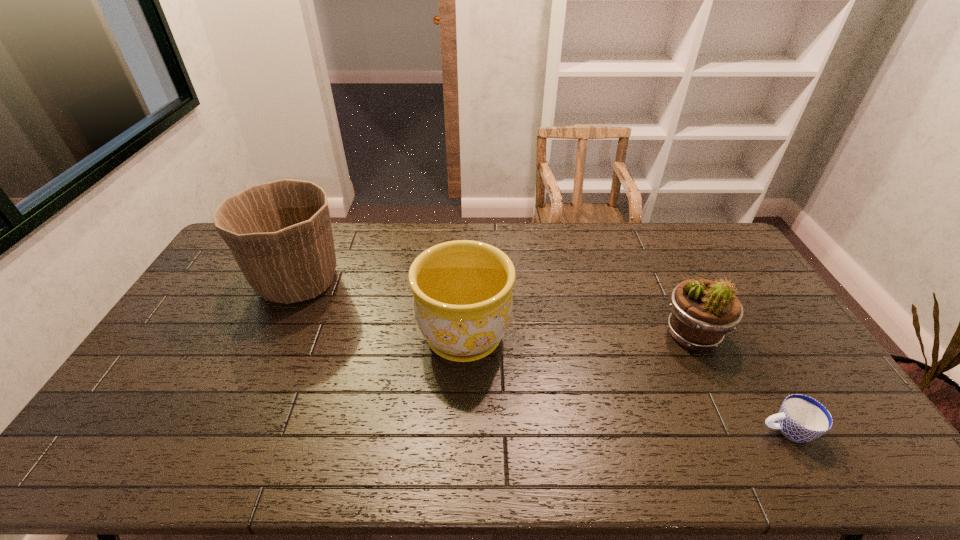
Locate which object is the second closest to the cup. Please provide its 2D coordinates. Your answer should be formatted as a tuple, i.e. [(x, y)], where the tuple contains the x and y coordinates of a point satisfying the conditions above.

[(462, 290)]

Identify which flowerpot is the third closest to the shortest object. Please provide its 2D coordinates. Your answer should be formatted as a tuple, i.e. [(x, y)], where the tuple contains the x and y coordinates of a point satisfying the conditions above.

[(280, 234)]

Where is `the second closest flowerpot to the third object from right to left`? The image size is (960, 540). the second closest flowerpot to the third object from right to left is located at coordinates (703, 311).

Identify the location of free location that satisfies the following two spatial constraints: 1. on the front side of the rightmost flowerpot; 2. on the right side of the tallest object. The image size is (960, 540). (274, 335).